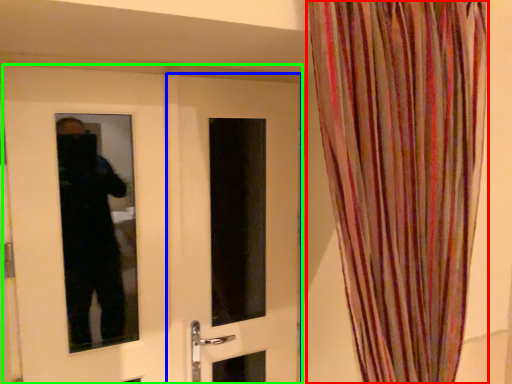
Question: Which object is the closest to the curtain (highlighted by a red box)? Choose among these: door (highlighted by a blue box) or door (highlighted by a green box).

Choices:
 (A) door
 (B) door

Answer: (A)